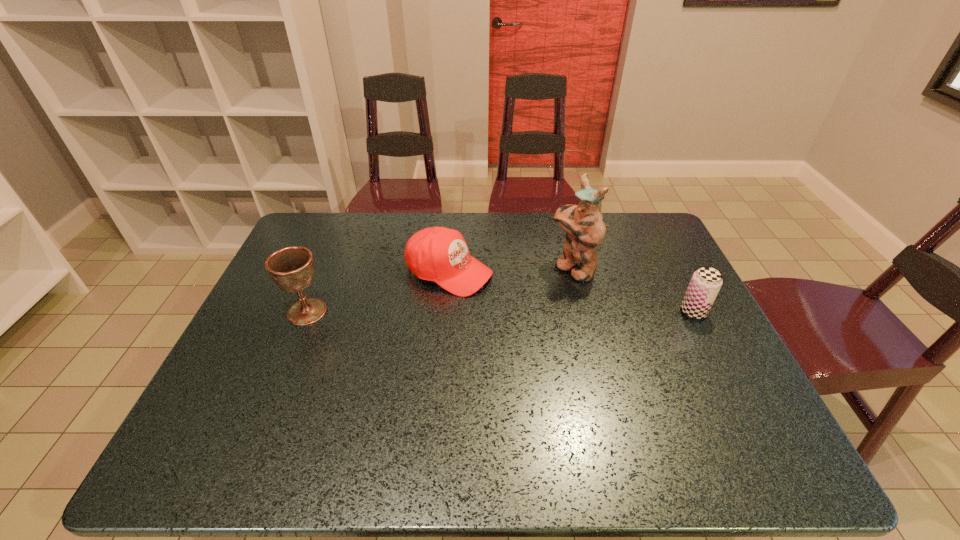
Locate an element on the screen. vacant point located 0.250m on the front-facing side of the tallest object is located at coordinates (492, 316).

Find the location of `free space located 0.290m on the front panel of the second object from left to right`. free space located 0.290m on the front panel of the second object from left to right is located at coordinates (580, 323).

You are a GUI agent. You are given a task and a screenshot of the screen. Output one action in this format:
    pyautogui.click(x=<x>, y=<y>)
    Task: Click on the free spot located 0.290m on the front panel of the second object from left to right
    The image size is (960, 540).
    Given the screenshot: What is the action you would take?
    580,323

Locate an element on the screen. vacant region located 0.050m on the front panel of the second object from left to right is located at coordinates (501, 291).

Where is `figurine at the far edge`? This screenshot has height=540, width=960. figurine at the far edge is located at coordinates (585, 227).

You are a GUI agent. You are given a task and a screenshot of the screen. Output one action in this format:
    pyautogui.click(x=<x>, y=<y>)
    Task: Click on the baseball cap at the far edge
    
    Given the screenshot: What is the action you would take?
    pyautogui.click(x=439, y=254)

This screenshot has height=540, width=960. I want to click on object that is at the left edge, so click(291, 268).

I want to click on object situated at the right edge, so click(x=706, y=282).

In the image, there is a desktop. Where is `vacant area at the far edge`? vacant area at the far edge is located at coordinates (498, 219).

In the image, there is a desktop. Where is `vacant space at the near edge`? This screenshot has width=960, height=540. vacant space at the near edge is located at coordinates (435, 420).